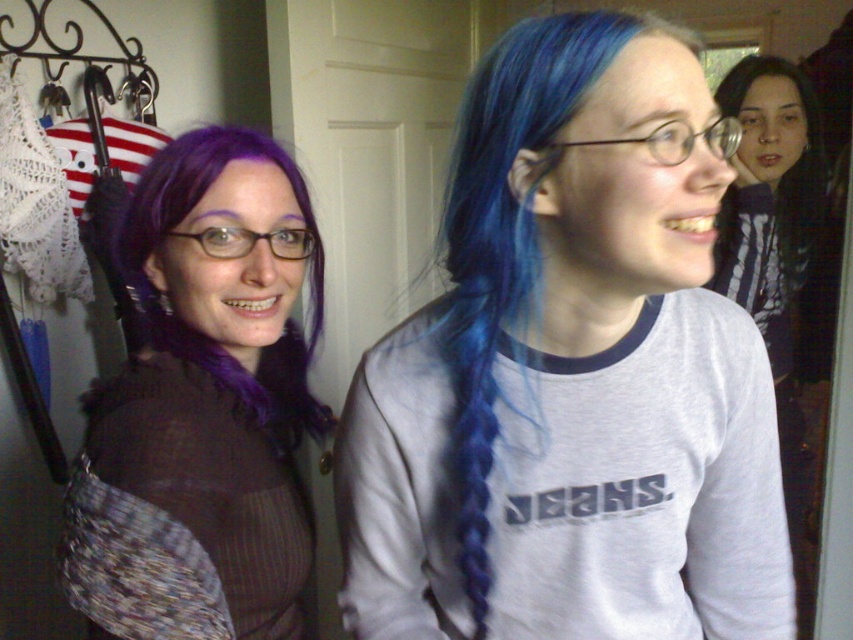
You are planning to take a photo of the blue hair at center and the blue dyed hair at upper right. Which one would you focus on first if you want to capture both in a single frame without moving the camera?

The blue hair at center is bigger than the blue dyed hair at upper right, so you should focus on the blue hair at center first to ensure it is clearly visible in the frame.

You are standing in the room and want to reach both the point at coordinates (463, 378) and the point at coordinates (758, 289). Which point should you reach first to minimize the distance walked?

You should reach point (463, 378) first because it is closer to you than point (758, 289).